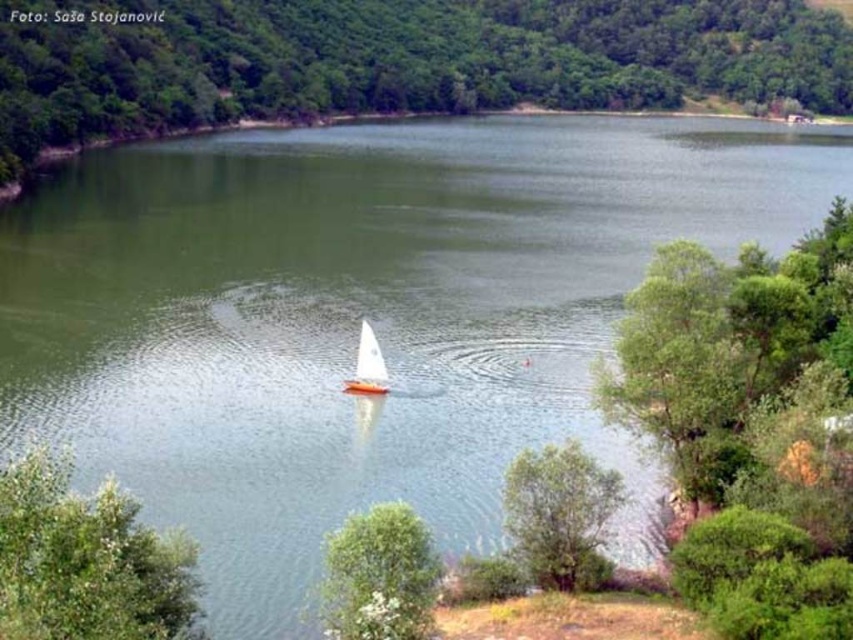
Question: Can you confirm if green leafy tree at center is wider than white matte sailboat at center?

Choices:
 (A) no
 (B) yes

Answer: (B)

Question: Among these objects, which one is farthest from the camera?

Choices:
 (A) green leafy tree at lower right
 (B) green leafy tree at lower left
 (C) white matte sailboat at center
 (D) green leafy tree at lower center

Answer: (C)

Question: Is green leafy tree at lower center to the right of white matte sailboat at center from the viewer's perspective?

Choices:
 (A) yes
 (B) no

Answer: (A)

Question: Based on their relative distances, which object is farther from the green leafy tree at lower center?

Choices:
 (A) green leafy tree at center
 (B) white matte sailboat at center

Answer: (A)

Question: Which point is closer to the camera?

Choices:
 (A) green leafy tree at lower right
 (B) green leafy tree at lower left

Answer: (B)

Question: Is green leafy tree at lower center smaller than green leafy tree at lower right?

Choices:
 (A) no
 (B) yes

Answer: (A)